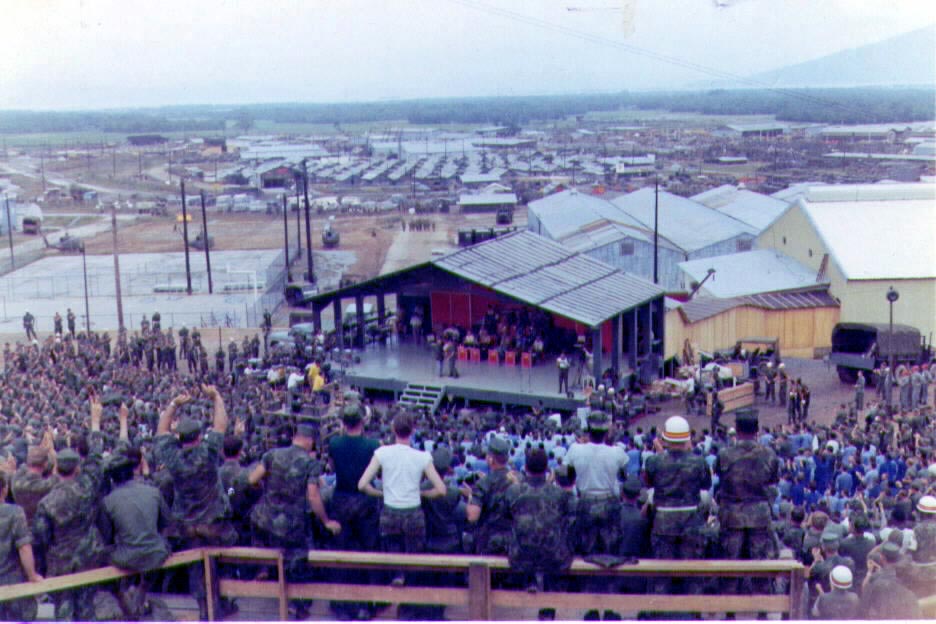
This screenshot has width=936, height=624. In order to click on wooden railing in this screenshot , I will do pos(386,596), pos(393,560).